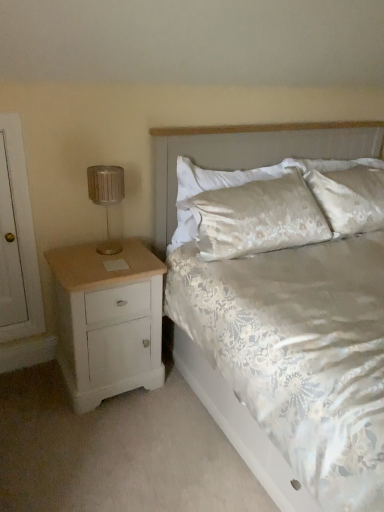
What is the approximate width of silky white pillow at upper center?

silky white pillow at upper center is 5.82 inches wide.

This screenshot has height=512, width=384. In order to click on white floral fabric bed at center in this screenshot , I will do `click(252, 151)`.

Locate an element on the screen. The height and width of the screenshot is (512, 384). satin fabric headboard at upper center is located at coordinates [250, 153].

What do you see at coordinates (250, 153) in the screenshot? The image size is (384, 512). I see `satin fabric headboard at upper center` at bounding box center [250, 153].

Identify the location of silky white pillow at upper center. The image size is (384, 512). (257, 217).

In terms of height, does satin fabric headboard at upper center look taller or shorter compared to metallic silver lamp at left?

In the image, satin fabric headboard at upper center appears to be taller than metallic silver lamp at left.

Can you confirm if satin fabric headboard at upper center is smaller than metallic silver lamp at left?

Actually, satin fabric headboard at upper center might be larger than metallic silver lamp at left.

From the picture: Between satin fabric headboard at upper center and metallic silver lamp at left, which one is positioned in front?

satin fabric headboard at upper center is more forward.

Is point (229, 153) behind point (111, 166)?

Yes.

Looking at this image, which of these two, silky white pillow at upper center or metallic silver lamp at left, stands shorter?

Standing shorter between the two is metallic silver lamp at left.

What are the coordinates of `pillow located behind the metallic silver lamp at left` in the screenshot? It's located at (257, 217).

Does point (238, 225) come behind point (123, 183)?

No, it is in front of (123, 183).

Is silky white pillow at upper center beside metallic silver lamp at left?

No, silky white pillow at upper center is not in contact with metallic silver lamp at left.

How much distance is there between metallic silver lamp at left and white floral fabric bed at center?

The distance of metallic silver lamp at left from white floral fabric bed at center is 20.23 inches.

Does metallic silver lamp at left touch white floral fabric bed at center?

metallic silver lamp at left and white floral fabric bed at center are not in contact.

Which is behind, point (99, 177) or point (165, 218)?

Positioned behind is point (165, 218).

Locate an element on the screen. The height and width of the screenshot is (512, 384). lamp positioned vertically above the white floral fabric bed at center (from a real-world perspective) is located at coordinates (106, 197).

Considering the relative positions of silky white pillow at upper center and white floral fabric bed at center in the image provided, is silky white pillow at upper center to the right of white floral fabric bed at center from the viewer's perspective?

No.

Which of these two, silky white pillow at upper center or white floral fabric bed at center, is smaller?

silky white pillow at upper center.

In terms of height, does silky white pillow at upper center look taller or shorter compared to white floral fabric bed at center?

In the image, silky white pillow at upper center appears to be shorter than white floral fabric bed at center.

From a real-world perspective, is silky white pillow at upper center over white floral fabric bed at center?

Yes.

Is white floral fabric bed at center located outside satin fabric headboard at upper center?

That's correct, white floral fabric bed at center is outside of satin fabric headboard at upper center.

What are the coordinates of `headboard that appears on the left of white floral fabric bed at center` in the screenshot? It's located at (250, 153).

Does white floral fabric bed at center have a larger size compared to satin fabric headboard at upper center?

Yes, white floral fabric bed at center is bigger than satin fabric headboard at upper center.

From a real-world perspective, is white floral fabric bed at center physically above satin fabric headboard at upper center?

No, from a real-world perspective, white floral fabric bed at center is not over satin fabric headboard at upper center

Which object is closer to the camera taking this photo, white painted wood nightstand at left or silky white pillow at upper center?

Positioned in front is white painted wood nightstand at left.

From the image's perspective, is white painted wood nightstand at left on silky white pillow at upper center?

Incorrect, from the image's perspective, white painted wood nightstand at left is lower than silky white pillow at upper center.

Between point (67, 298) and point (263, 185), which one is positioned in front?

Positioned in front is point (67, 298).

Based on the photo, does white painted wood nightstand at left have a greater height compared to silky white pillow at upper center?

Yes, white painted wood nightstand at left is taller than silky white pillow at upper center.

From the image's perspective, would you say white painted wood nightstand at left is positioned over metallic silver lamp at left?

No, from the image's perspective, white painted wood nightstand at left is not on top of metallic silver lamp at left.

Which is farther from the camera, (69, 312) or (116, 188)?

The point (116, 188) is more distant.

Is white painted wood nightstand at left facing towards metallic silver lamp at left?

No, white painted wood nightstand at left is not oriented towards metallic silver lamp at left.

Considering the relative sizes of white painted wood nightstand at left and metallic silver lamp at left in the image provided, is white painted wood nightstand at left bigger than metallic silver lamp at left?

Yes.

The width and height of the screenshot is (384, 512). I want to click on headboard located in front of the metallic silver lamp at left, so click(250, 153).

Locate an element on the screen. The image size is (384, 512). lamp that appears below the silky white pillow at upper center (from the image's perspective) is located at coordinates (106, 197).

Looking at the image, which one is located further to silky white pillow at upper center, metallic silver lamp at left or white painted wood nightstand at left?

metallic silver lamp at left lies further to silky white pillow at upper center than the other object.

Considering their positions, is metallic silver lamp at left positioned closer to silky white pillow at upper center than satin fabric headboard at upper center?

The object closer to silky white pillow at upper center is satin fabric headboard at upper center.

From the image, which object appears to be nearer to white painted wood nightstand at left, silky white pillow at upper center or white floral fabric bed at center?

The object closer to white painted wood nightstand at left is silky white pillow at upper center.

Estimate the real-world distances between objects in this image. Which object is closer to silky white pillow at upper center, satin fabric headboard at upper center or metallic silver lamp at left?

satin fabric headboard at upper center lies closer to silky white pillow at upper center than the other object.

Looking at the image, which one is located closer to metallic silver lamp at left, white floral fabric bed at center or silky white pillow at upper center?

Based on the image, white floral fabric bed at center appears to be nearer to metallic silver lamp at left.

Looking at the image, which one is located closer to satin fabric headboard at upper center, white painted wood nightstand at left or white floral fabric bed at center?

white floral fabric bed at center is positioned closer to the anchor satin fabric headboard at upper center.

Based on their spatial positions, is satin fabric headboard at upper center or white floral fabric bed at center closer to white painted wood nightstand at left?

white floral fabric bed at center lies closer to white painted wood nightstand at left than the other object.

When comparing their distances from metallic silver lamp at left, does white painted wood nightstand at left or satin fabric headboard at upper center seem closer?

Among the two, white painted wood nightstand at left is located nearer to metallic silver lamp at left.

Locate an element on the screen. The height and width of the screenshot is (512, 384). lamp positioned between white floral fabric bed at center and silky white pillow at upper center from near to far is located at coordinates (106, 197).

Identify the location of headboard situated between white painted wood nightstand at left and white floral fabric bed at center from left to right. The width and height of the screenshot is (384, 512). (250, 153).

Where is `headboard between white floral fabric bed at center and metallic silver lamp at left in the front-back direction`? This screenshot has width=384, height=512. headboard between white floral fabric bed at center and metallic silver lamp at left in the front-back direction is located at coordinates (250, 153).

The image size is (384, 512). Find the location of `lamp between white painted wood nightstand at left and silky white pillow at upper center`. lamp between white painted wood nightstand at left and silky white pillow at upper center is located at coordinates click(106, 197).